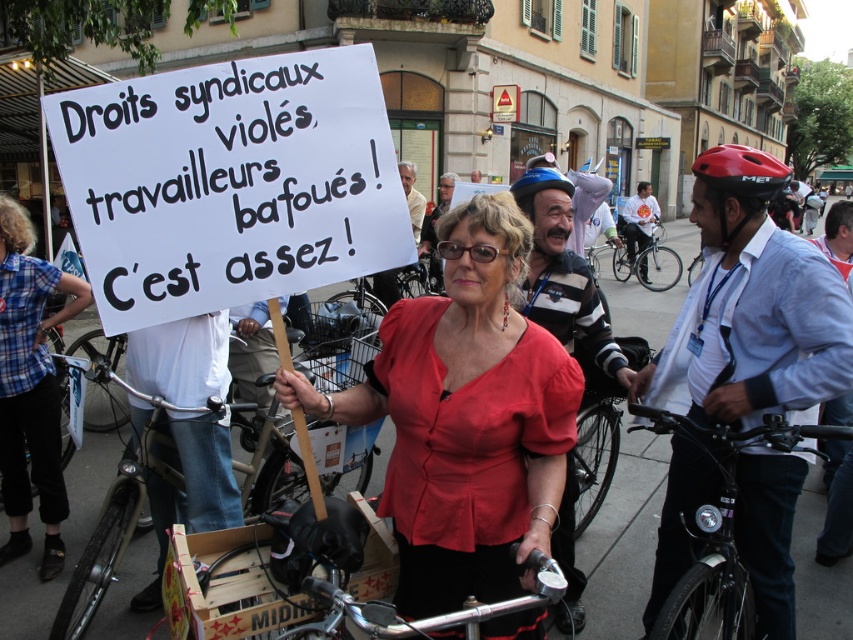
Question: Can you confirm if white paper sign at center is positioned above polished chrome handlebars at center?

Choices:
 (A) yes
 (B) no

Answer: (A)

Question: Where is matte red blouse at center located in relation to silver metallic bicycle at center in the image?

Choices:
 (A) above
 (B) below

Answer: (B)

Question: Which of the following is the farthest from the observer?

Choices:
 (A) (775, 412)
 (B) (572, 195)

Answer: (B)

Question: Which object is closer to the camera taking this photo?

Choices:
 (A) white paper sign at center
 (B) blue plaid shirt at left

Answer: (A)

Question: Which of the following is the closest to the observer?

Choices:
 (A) (24, 330)
 (B) (300, 60)
 (C) (674, 278)

Answer: (B)

Question: Can you confirm if silver metallic bicycle at center is positioned to the left of white shirt at center?

Choices:
 (A) yes
 (B) no

Answer: (A)